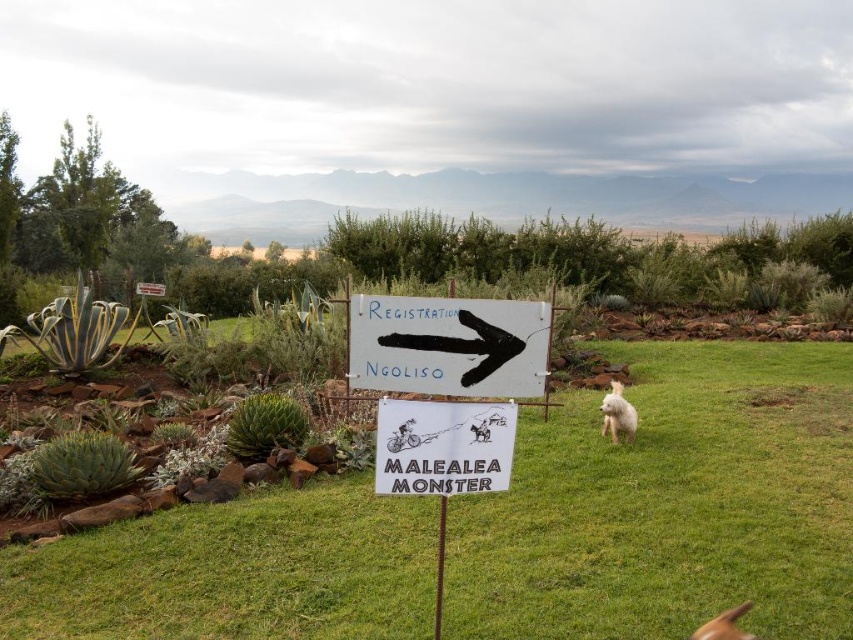
You are a hiker who just arrived at the registration area. You see the green grass at center and the white fluffy dog at right. Which direction should you walk to reach the NGOLISO sign mentioned on the signpost?

The NGOLISO sign is to the left of the white fluffy dog at right, so you should walk towards the green grass at center direction to reach it.

You are a photographer setting up a shot of the green grass at center and the white fluffy dog at right. If your camera has a maximum focus range of 8 feet, will you be able to capture both subjects in focus without moving either?

The distance between the green grass at center and the white fluffy dog at right is 8.50 feet, which exceeds the camera maximum focus range of 8 feet. Therefore, you won need to move either subject to ensure both are in focus.

Based on the photo, you are standing at the signpost with three signs in the middle of the outdoor scene. You want to take a photo that includes both points labeled as point 1 at (x=537, y=337) and point 2 at (x=625, y=432). Which point should you move the camera towards to ensure both points are in frame?

To include both points in the frame, you should move the camera towards point 2 at (x=625, y=432) because point 1 at (x=537, y=337) is closer to the camera. By moving towards point 2, you can adjust the focal length or angle to ensure both points are within the camera view.